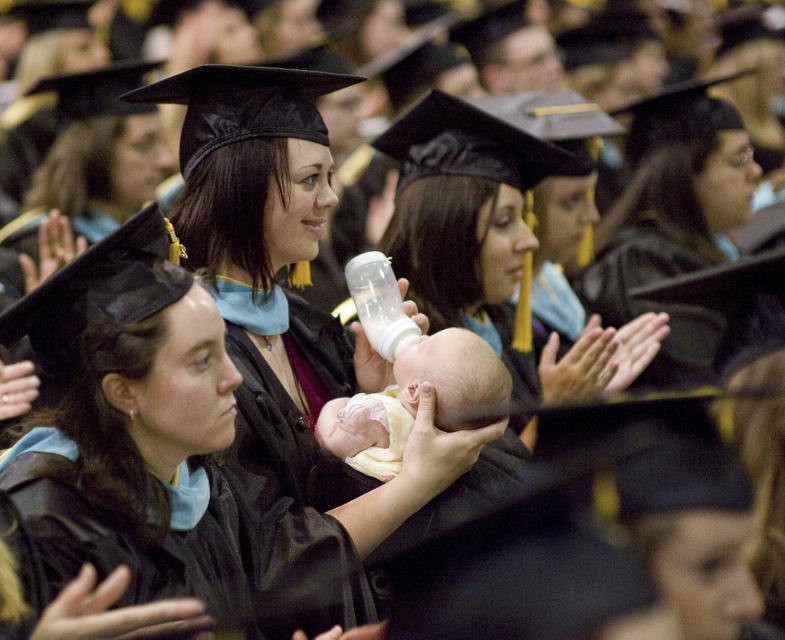
Between point (633, 276) and point (393, 282), which one is positioned behind?

Positioned behind is point (633, 276).

Which is below, matte black graduation cap at center or transparent plastic baby bottle at center?

transparent plastic baby bottle at center is below.

Between point (634, 259) and point (414, 324), which one is positioned behind?

The point (634, 259) is behind.

Where is `matte black graduation cap at center`? The image size is (785, 640). matte black graduation cap at center is located at coordinates (674, 221).

Does soft white skin at center lie in front of transparent plastic baby bottle at center?

Yes.

Does point (469, 403) come in front of point (393, 348)?

Yes, it is in front of point (393, 348).

Where is `soft white skin at center`? This screenshot has width=785, height=640. soft white skin at center is located at coordinates (413, 400).

Which is more to the left, matte black graduation cap at center or soft white skin at center?

Positioned to the left is soft white skin at center.

Who is positioned more to the right, matte black graduation cap at center or soft white skin at center?

Positioned to the right is matte black graduation cap at center.

Who is more forward, (634, 284) or (420, 362)?

Positioned in front is point (420, 362).

The width and height of the screenshot is (785, 640). In order to click on matte black graduation cap at center in this screenshot , I will do `click(674, 221)`.